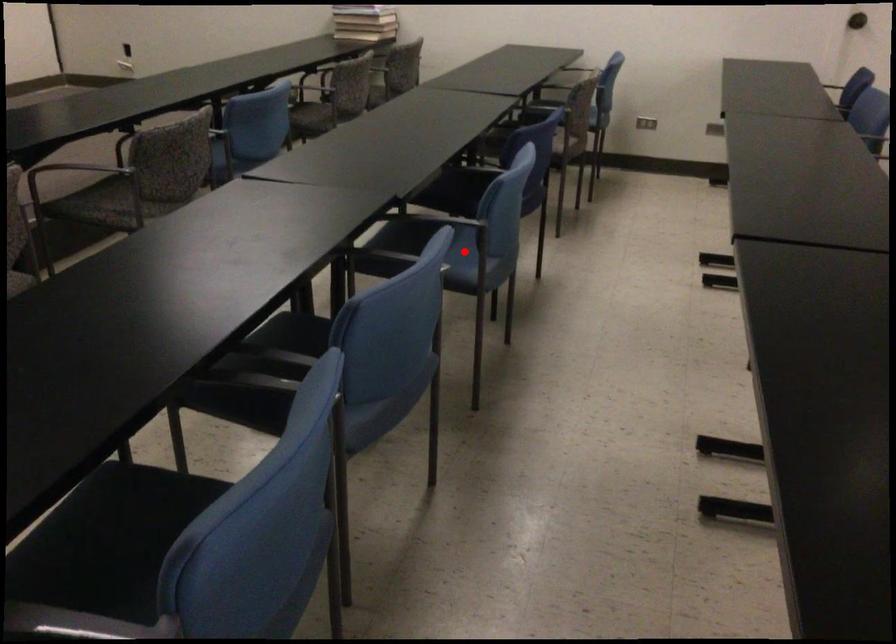
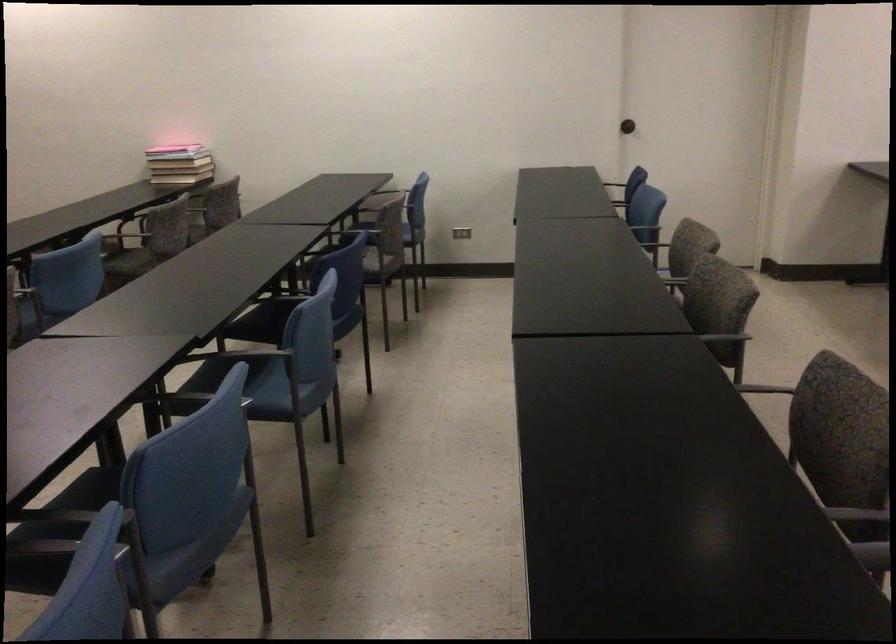
The point at the highlighted location is marked in the first image. Where is the corresponding point in the second image?

(281, 382)